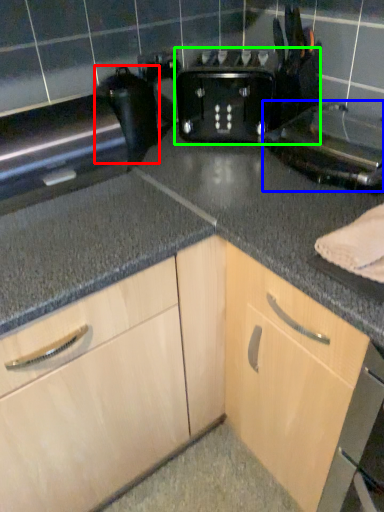
Question: Which is farther away from appliance (highlighted by a red box)? appliance (highlighted by a blue box) or toaster (highlighted by a green box)?

Choices:
 (A) appliance
 (B) toaster

Answer: (A)